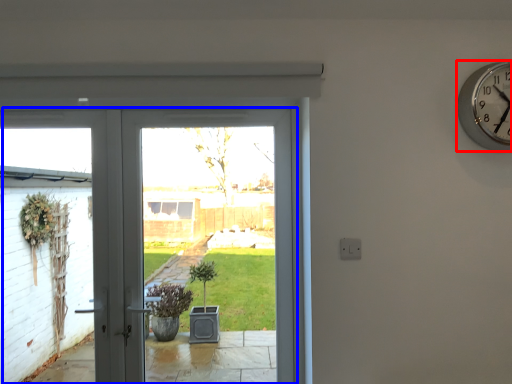
Question: Which object is further to the camera taking this photo, wall clock (highlighted by a red box) or door (highlighted by a blue box)?

Choices:
 (A) wall clock
 (B) door

Answer: (B)